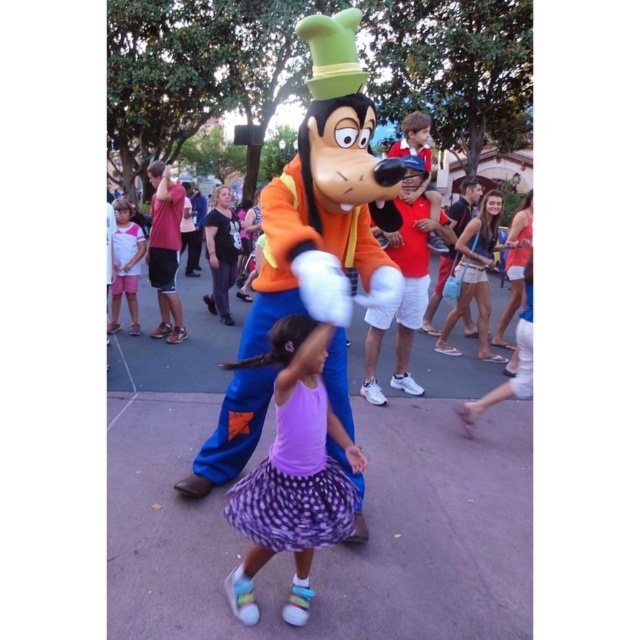
Question: Can you confirm if matte orange costume at center is positioned below matte red shirt at left?

Choices:
 (A) no
 (B) yes

Answer: (B)

Question: Considering the real-world distances, which object is farthest from the purple dotted skirt at center?

Choices:
 (A) white cotton shirt at left
 (B) light brown denim shorts at upper right
 (C) matte orange costume at center
 (D) matte red shirt at left

Answer: (A)

Question: Is purple dotted skirt at center to the left of matte red shirt at left from the viewer's perspective?

Choices:
 (A) yes
 (B) no

Answer: (B)

Question: Is matte orange costume at center further to camera compared to purple dotted skirt at center?

Choices:
 (A) yes
 (B) no

Answer: (B)

Question: Considering the real-world distances, which object is farthest from the matte red shirt at left?

Choices:
 (A) purple dotted skirt at center
 (B) matte orange costume at center
 (C) white cotton shirt at left
 (D) light brown denim shorts at upper right

Answer: (A)

Question: Which of the following is the closest to the observer?

Choices:
 (A) (364, 296)
 (B) (122, 264)

Answer: (A)